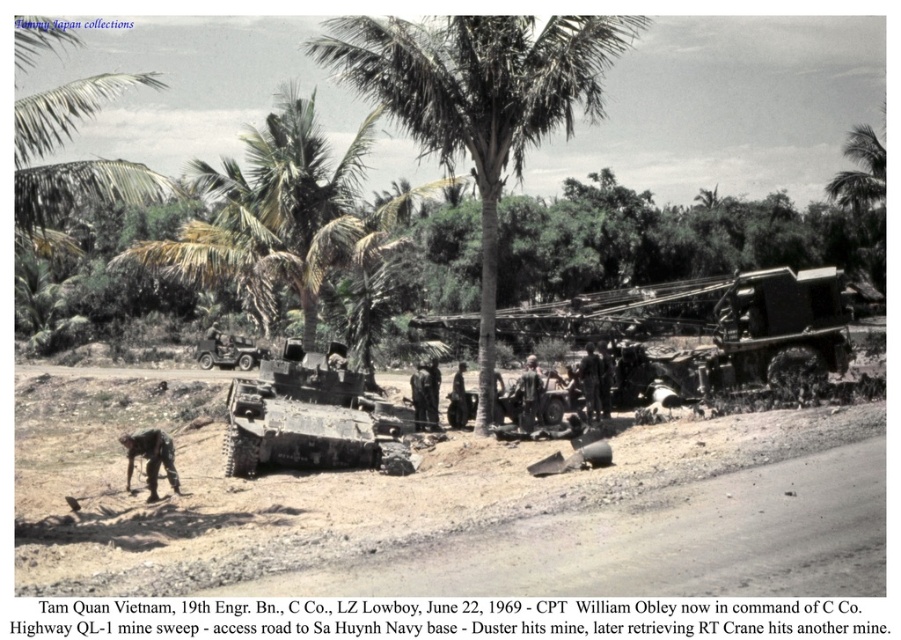
You are a soldier in the field and need to use the camouflage paint tank at center for cover. However, you notice a green leafy palm tree at center nearby. Which object is taller and can provide better overhead cover against aerial surveillance?

The green leafy palm tree at center is much taller than the camouflage paint tank at center, so it can provide better overhead cover against aerial surveillance.

You are a photographer aiming to capture a clear photo of the camouflage fabric uniform at center. However, there is a camouflage fabric soldier at lower left blocking your view. Can you adjust your position to avoid the obstruction?

Yes, since the camouflage fabric soldier at lower left is in front of the camouflage fabric uniform at center, you can move your position to the side or behind the soldier to get an unobstructed view of the camouflage fabric uniform at center.